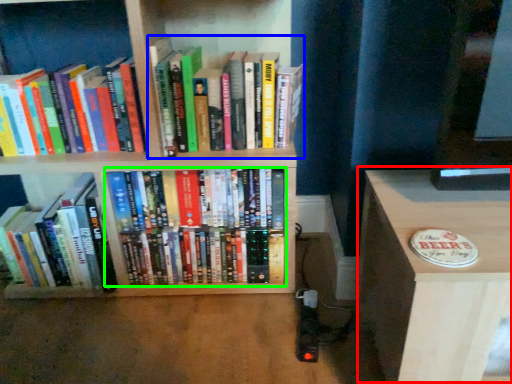
Question: Considering the real-world distances, which object is farthest from table (highlighted by a red box)? book (highlighted by a blue box) or book (highlighted by a green box)?

Choices:
 (A) book
 (B) book

Answer: (A)